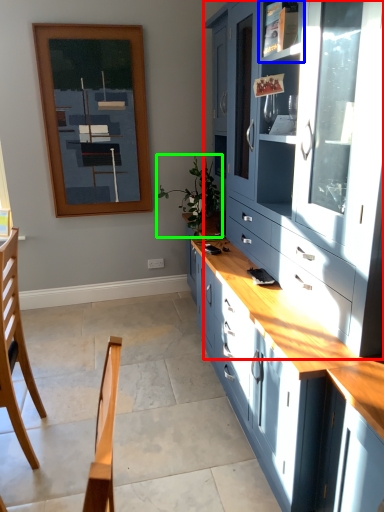
Question: Which object is the closest to the cabinetry (highlighted by a red box)? Choose among these: shelf (highlighted by a blue box) or plant (highlighted by a green box).

Choices:
 (A) shelf
 (B) plant

Answer: (A)